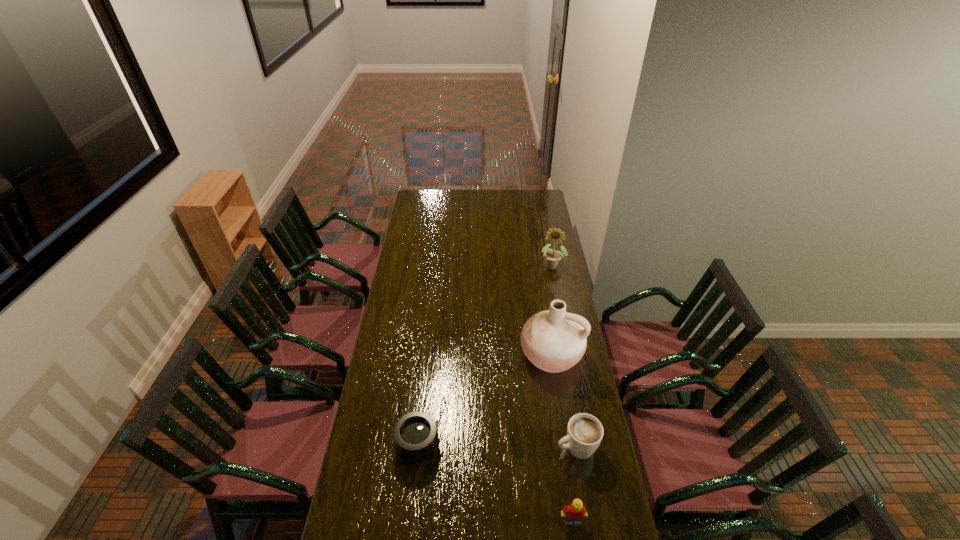
In order to click on vacant area that lies between the telephoto lens and the cappuccino in this screenshot , I will do `click(497, 446)`.

Where is `empty location between the telephoto lens and the pottery`? empty location between the telephoto lens and the pottery is located at coordinates (485, 401).

At what (x,y) coordinates should I click in order to perform the action: click on vacant region between the farthest object and the leftmost object. Please return your answer as a coordinate pair (x, y). Looking at the image, I should click on (485, 356).

Where is `free space between the cappuccino and the shortest object`? free space between the cappuccino and the shortest object is located at coordinates (497, 446).

Select which object is the third closest to the telephoto lens. Please provide its 2D coordinates. Your answer should be formatted as a tuple, i.e. [(x, y)], where the tuple contains the x and y coordinates of a point satisfying the conditions above.

[(573, 514)]

What are the coordinates of `object that stands as the second closest to the fourth nearest object` in the screenshot? It's located at (415, 434).

Find the location of a particular element. blank area in the image that satisfies the following two spatial constraints: 1. on the front side of the pottery; 2. on the left side of the cappuccino is located at coordinates (565, 447).

The width and height of the screenshot is (960, 540). In order to click on vacant area that satisfies the following two spatial constraints: 1. on the back side of the pottery; 2. on the left side of the sunflower in this screenshot , I will do `click(538, 266)`.

In order to click on free space in the image that satisfies the following two spatial constraints: 1. on the back side of the cappuccino; 2. on the left side of the sunflower in this screenshot , I will do `click(545, 266)`.